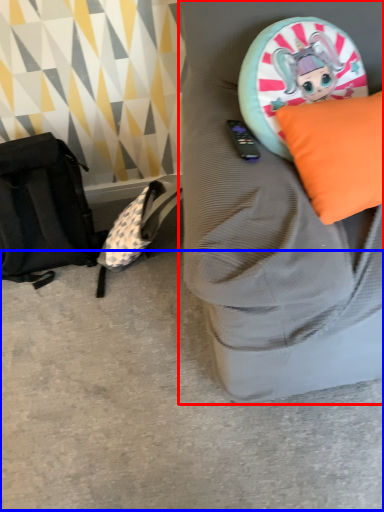
Question: Which of the following is the closest to the observer, furniture (highlighted by a red box) or concrete (highlighted by a blue box)?

Choices:
 (A) furniture
 (B) concrete

Answer: (A)